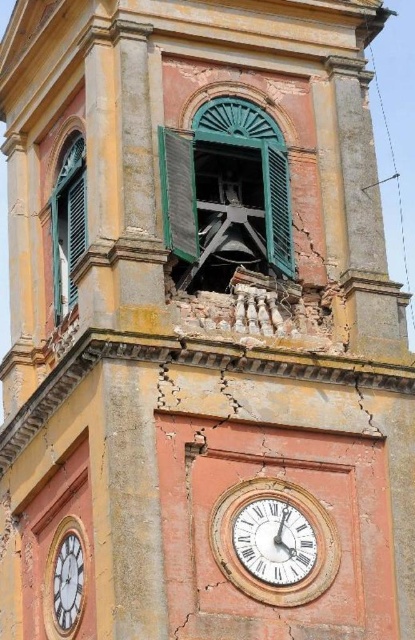
Question: Does gold-toned brass clock at center appear over green matte shutter at center?

Choices:
 (A) yes
 (B) no

Answer: (B)

Question: Is gold-toned brass clock at center thinner than green matte shutter at center?

Choices:
 (A) no
 (B) yes

Answer: (A)

Question: Can you confirm if gold-toned brass clock at center is positioned below white matte clock at lower left?

Choices:
 (A) yes
 (B) no

Answer: (B)

Question: Among these points, which one is farthest from the camera?

Choices:
 (A) (280, 531)
 (B) (192, 208)
 (C) (293, 557)
 (D) (83, 545)

Answer: (B)

Question: Which of the following is the farthest from the observer?

Choices:
 (A) white wooden clock at center
 (B) white matte clock at lower left
 (C) gold-toned brass clock at center

Answer: (B)

Question: Estimate the real-world distances between objects in this image. Which object is closer to the green matte shutter at center?

Choices:
 (A) white matte clock at lower left
 (B) gold-toned brass clock at center
 (C) white wooden clock at center

Answer: (B)